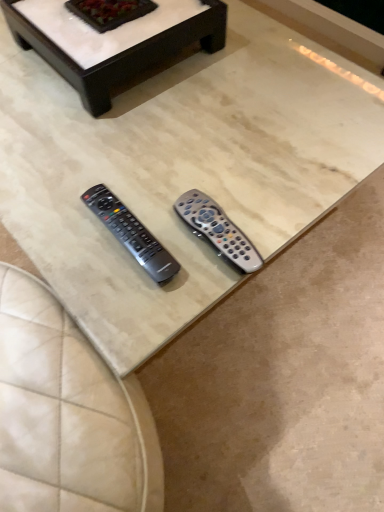
Locate an element on the screen. This screenshot has width=384, height=512. free space on the front side of white marble coffee table at upper center, which ranks as the first coffee table in back-to-front order is located at coordinates (128, 142).